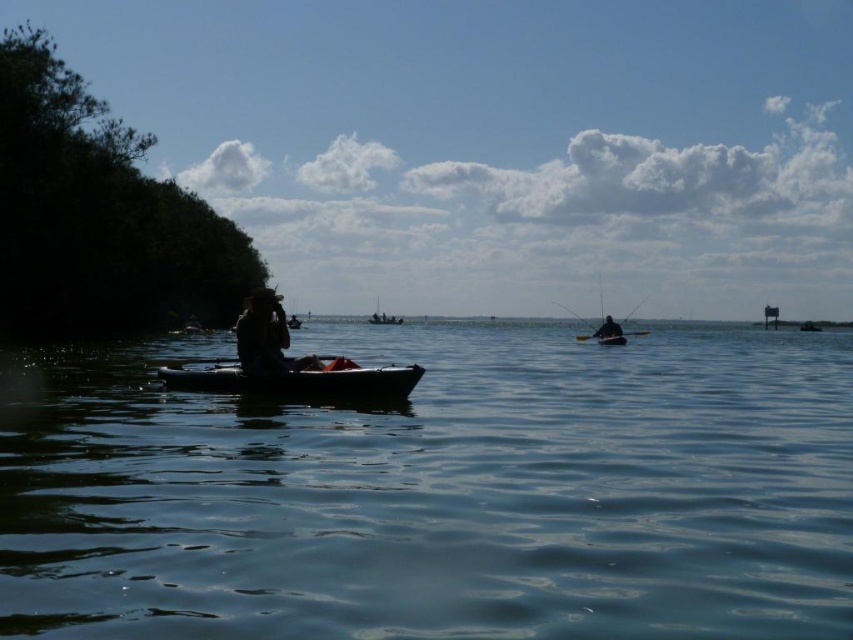
Find the location of a particular element. Image resolution: width=853 pixels, height=640 pixels. white plastic boat at center is located at coordinates (384, 320).

Does white plastic boat at center have a larger size compared to black plastic paddle at center?

Yes, white plastic boat at center is bigger than black plastic paddle at center.

Locate an element on the screen. This screenshot has height=640, width=853. white plastic boat at center is located at coordinates (384, 320).

The image size is (853, 640). I want to click on white plastic boat at center, so click(x=384, y=320).

Which is more to the left, transparent blue water at center or matte brown hat at center?

Positioned to the left is matte brown hat at center.

Is transparent blue water at center below matte brown hat at center?

Indeed, transparent blue water at center is positioned under matte brown hat at center.

Between point (465, 592) and point (276, 362), which one is positioned behind?

Point (276, 362)

The image size is (853, 640). What are the coordinates of `transparent blue water at center` in the screenshot? It's located at (440, 493).

Which is below, transparent blue water at center or dark green plastic boat at center?

Positioned lower is transparent blue water at center.

Does transparent blue water at center have a greater height compared to dark green plastic boat at center?

Incorrect, transparent blue water at center's height is not larger of dark green plastic boat at center's.

Which is in front, point (786, 522) or point (399, 323)?

Positioned in front is point (786, 522).

The width and height of the screenshot is (853, 640). I want to click on transparent blue water at center, so click(x=440, y=493).